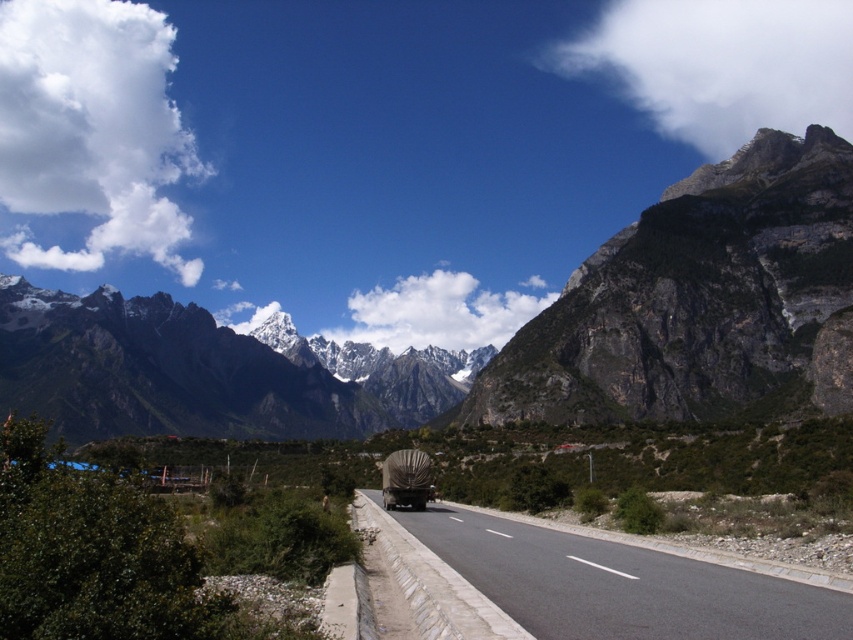
You are a delivery driver approaching the black asphalt road at center. Your truck requires a minimum clearance of 190 feet to safely navigate a sharp turn ahead. Based on the scene, can you safely make the turn?

The black asphalt road at center is 191.20 feet from camera, which exceeds the minimum required clearance of 190 feet. Therefore, you can safely make the turn.

You are a hiker planning to take the black asphalt road at center to reach the dark gray rocky mountain at upper right. Based on the scene, will the road lead you directly to the mountain?

The dark gray rocky mountain at upper right is positioned over the black asphalt road at center, which means the road is heading in the direction of the mountain. Therefore, the road should lead you directly to the mountain.

You are a hiker planning to take the black asphalt road at center to reach the dark gray rocky mountain at upper right. Based on the scene, which direction should you head along the road to approach the mountain?

The dark gray rocky mountain at upper right is positioned on the right side of black asphalt road at center, so you should head towards the right side of the road to approach the mountain.